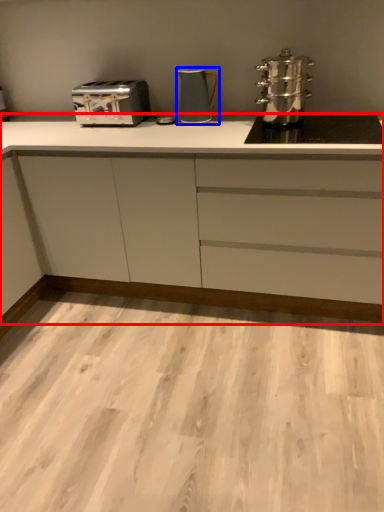
Question: Which of the following is the closest to the observer, cabinetry (highlighted by a red box) or kitchen appliance (highlighted by a blue box)?

Choices:
 (A) cabinetry
 (B) kitchen appliance

Answer: (A)